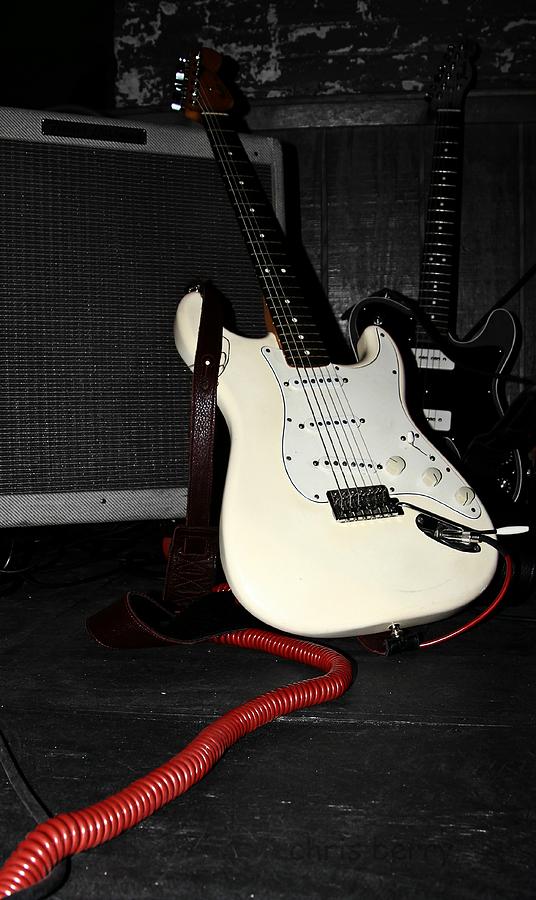
You are a GUI agent. You are given a task and a screenshot of the screen. Output one action in this format:
    pyautogui.click(x=<x>, y=<y>)
    Task: Click on the wood wall
    The width and height of the screenshot is (536, 900).
    Given the screenshot: What is the action you would take?
    pyautogui.click(x=385, y=214)